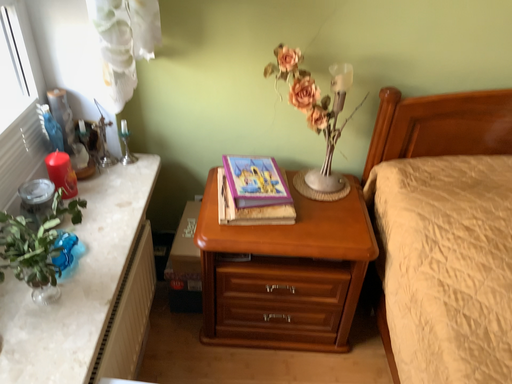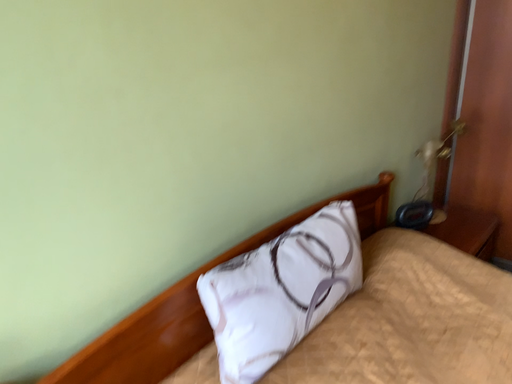
Question: How did the camera likely rotate when shooting the video?

Choices:
 (A) rotated downward
 (B) rotated upward

Answer: (B)